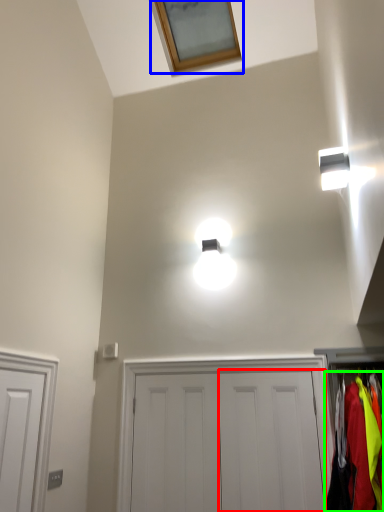
Question: Based on their relative distances, which object is farther from door (highlighted by a red box)? Choose from window (highlighted by a blue box) and clothing (highlighted by a green box).

Choices:
 (A) window
 (B) clothing

Answer: (A)